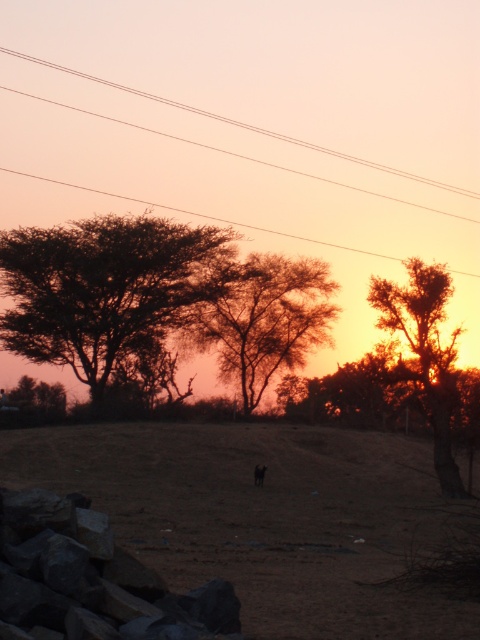
Is brown dirt field at center positioned before brown textured tree at center?

Yes, it is in front of brown textured tree at center.

Does brown dirt field at center appear over brown textured tree at center?

Incorrect, brown dirt field at center is not positioned above brown textured tree at center.

Which is in front, point (259, 550) or point (314, 316)?

Point (259, 550) is in front.

The width and height of the screenshot is (480, 640). I want to click on brown dirt field at center, so click(x=264, y=516).

Who is positioned more to the right, brown textured tree at center or smooth wire power lines at upper center?

Positioned to the right is brown textured tree at center.

Who is taller, brown textured tree at center or smooth wire power lines at upper center?

Standing taller between the two is smooth wire power lines at upper center.

Does point (296, 260) lie behind point (322, 148)?

That is False.

Image resolution: width=480 pixels, height=640 pixels. Identify the location of brown textured tree at center. (264, 321).

The width and height of the screenshot is (480, 640). What do you see at coordinates (104, 288) in the screenshot? I see `silhouette leafy tree at center` at bounding box center [104, 288].

Is silhouette leafy tree at center bigger than brown textured tree at center?

Yes.

This screenshot has height=640, width=480. I want to click on silhouette leafy tree at center, so click(x=104, y=288).